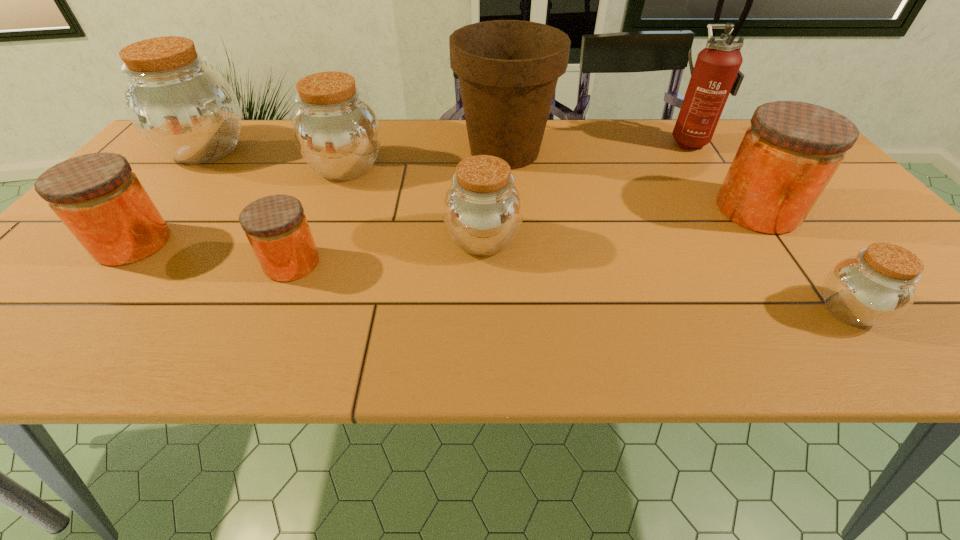
At what (x,y) coordinates should I click in order to perform the action: click on free space located on the front of the second nearest brown jar. Please return your answer as a coordinate pair (x, y). The height and width of the screenshot is (540, 960). Looking at the image, I should click on (483, 288).

The height and width of the screenshot is (540, 960). I want to click on vacant space located 0.130m on the right of the second orange jar from right to left, so click(382, 264).

The width and height of the screenshot is (960, 540). I want to click on vacant space located 0.190m on the back of the nearest object, so click(x=784, y=225).

The image size is (960, 540). Find the location of `fire extinguisher that is at the far edge`. fire extinguisher that is at the far edge is located at coordinates (716, 74).

This screenshot has height=540, width=960. I want to click on flowerpot positioned at the far edge, so click(508, 70).

The width and height of the screenshot is (960, 540). Find the location of `object at the near edge`. object at the near edge is located at coordinates (878, 285).

Locate an element on the screen. object present at the far left corner is located at coordinates (185, 109).

Find the location of a particular element. This screenshot has width=960, height=540. object present at the near right corner is located at coordinates (878, 285).

In the image, there is a desktop. Where is `free region at the far edge`? The height and width of the screenshot is (540, 960). free region at the far edge is located at coordinates (725, 141).

Where is `vacant space at the near edge of the desktop`? This screenshot has width=960, height=540. vacant space at the near edge of the desktop is located at coordinates (663, 354).